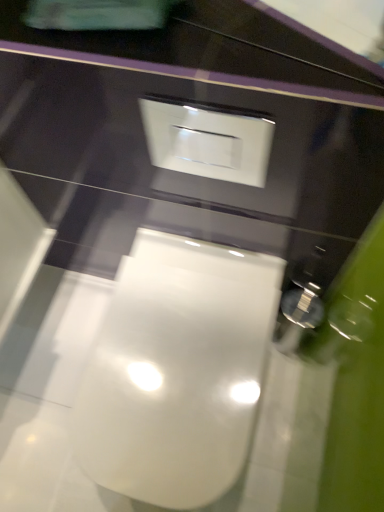
Question: From the image's perspective, is white glossy switch at upper center below white glossy toilet at center?

Choices:
 (A) no
 (B) yes

Answer: (A)

Question: Does white glossy switch at upper center have a greater width compared to white glossy toilet at center?

Choices:
 (A) no
 (B) yes

Answer: (A)

Question: Is white glossy switch at upper center surrounding white glossy toilet at center?

Choices:
 (A) no
 (B) yes

Answer: (A)

Question: Considering the relative sizes of white glossy switch at upper center and white glossy toilet at center in the image provided, is white glossy switch at upper center smaller than white glossy toilet at center?

Choices:
 (A) no
 (B) yes

Answer: (B)

Question: Is white glossy switch at upper center to the left of white glossy toilet at center from the viewer's perspective?

Choices:
 (A) yes
 (B) no

Answer: (B)

Question: Can you confirm if white glossy switch at upper center is shorter than white glossy toilet at center?

Choices:
 (A) no
 (B) yes

Answer: (B)

Question: Is white glossy toilet at center shorter than white glossy switch at upper center?

Choices:
 (A) no
 (B) yes

Answer: (A)

Question: Is white glossy toilet at center taller than white glossy switch at upper center?

Choices:
 (A) yes
 (B) no

Answer: (A)

Question: Is white glossy toilet at center to the right of white glossy switch at upper center from the viewer's perspective?

Choices:
 (A) yes
 (B) no

Answer: (B)

Question: Is white glossy toilet at center facing away from white glossy switch at upper center?

Choices:
 (A) yes
 (B) no

Answer: (B)

Question: Could white glossy switch at upper center be considered to be inside white glossy toilet at center?

Choices:
 (A) yes
 (B) no

Answer: (B)

Question: Does white glossy toilet at center have a lesser width compared to white glossy switch at upper center?

Choices:
 (A) no
 (B) yes

Answer: (A)

Question: From the image's perspective, is white glossy switch at upper center above or below white glossy toilet at center?

Choices:
 (A) below
 (B) above

Answer: (B)